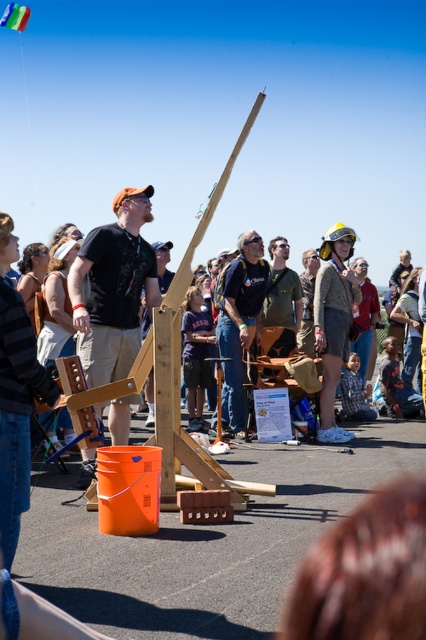
You are a photographer at the event and want to capture the man in the matte black shirt at center. Where should you position your camera to ensure he is in the frame?

The matte black shirt at center is located at point [114,289], so position the camera at that coordinate to capture him in the frame.

Looking at this image, you are standing at the position of the man in the scene. You want to walk to the point labeled as point (264,296). Which direction should you go relative to point (108,304)?

Since point (108,304) is in front of point (264,296), you should move backward to reach point (264,296) from your current position.

You are a photographer at the event and want to capture both the matte black shirt at center and the matte blue shirt at center in the same frame. Which person should you focus on first to ensure both are in the shot?

The matte black shirt at center is taller than the matte blue shirt at center. To ensure both are in the shot, focus on the taller person first, which is the matte black shirt at center, then adjust the frame to include the shorter one.